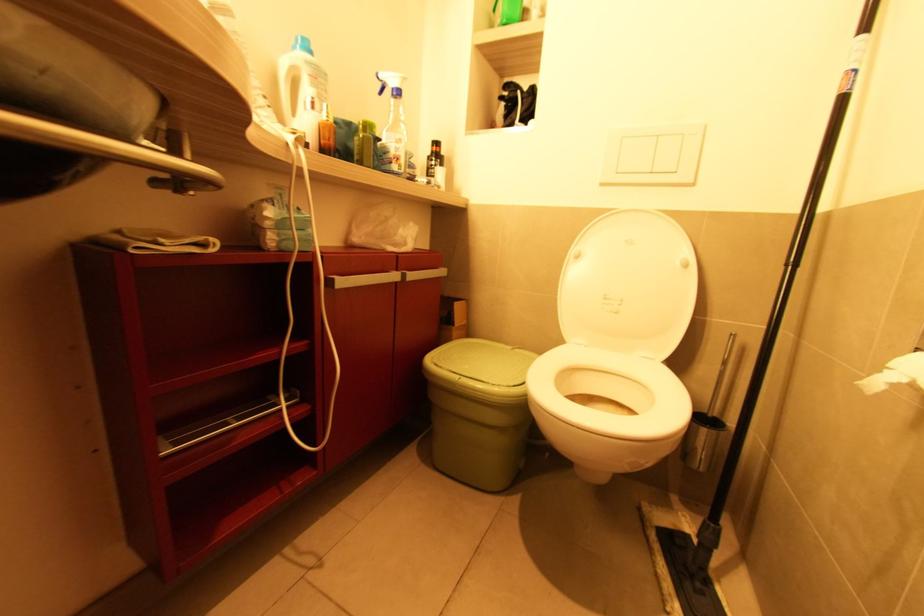
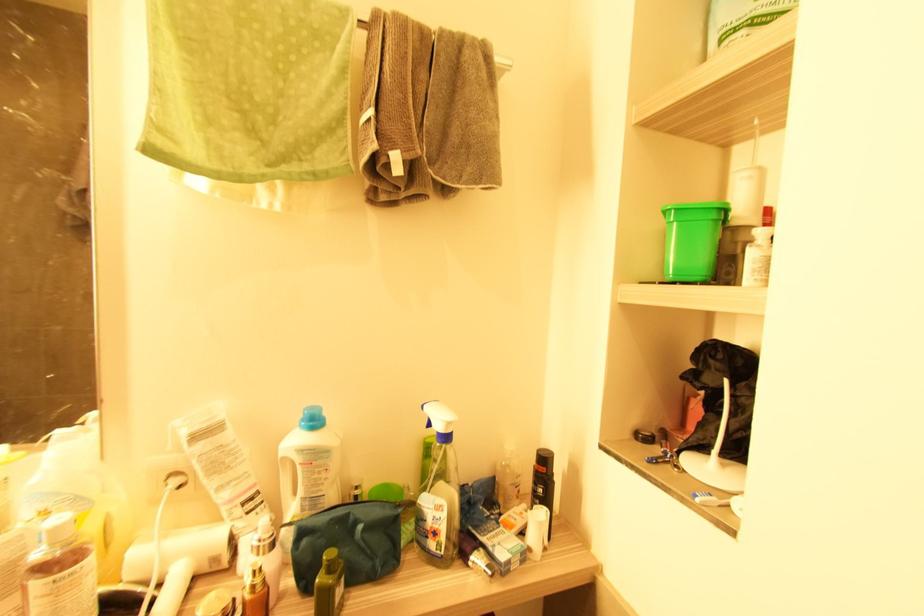
In the second image, find the point that corresponds to pixel 440 150 in the first image.

(545, 469)